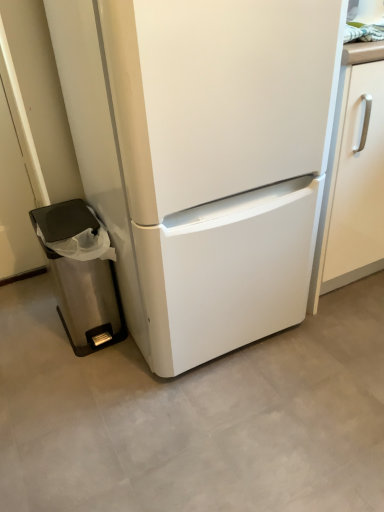
Image resolution: width=384 pixels, height=512 pixels. Find the location of `empty space that is ontop of stainless steel trash can at left (from a real-world perspective)`. empty space that is ontop of stainless steel trash can at left (from a real-world perspective) is located at coordinates (72, 216).